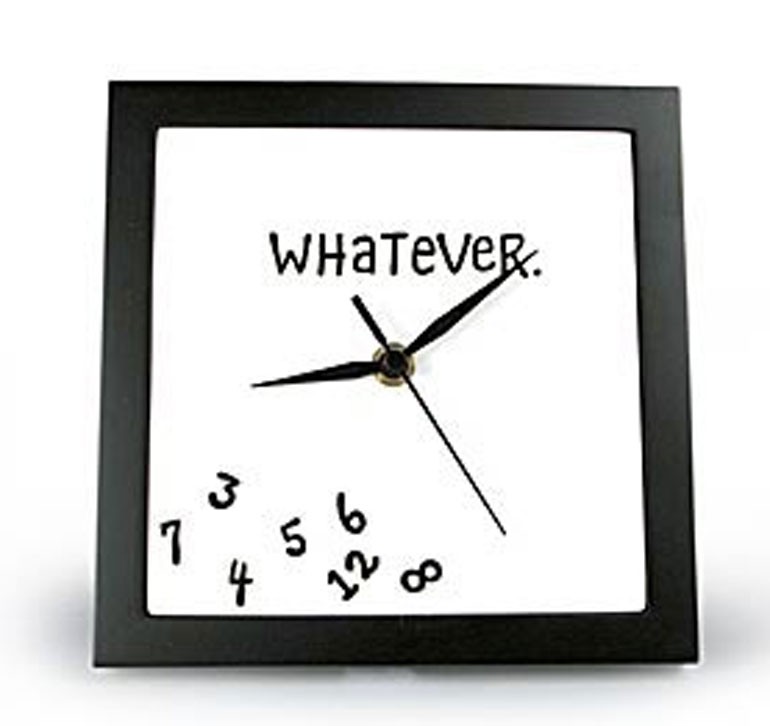
Where is `frame`? This screenshot has height=726, width=770. frame is located at coordinates (111, 497).